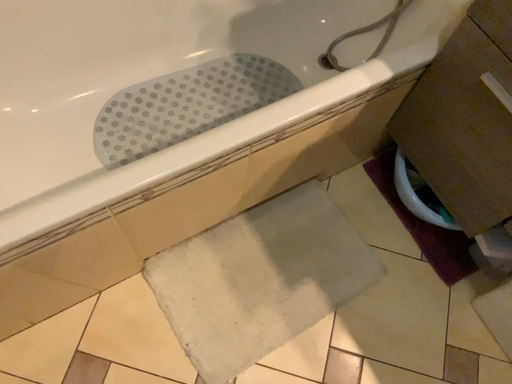
Identify the location of vacant area in front of beige matte tile at lower right. pos(476,361).